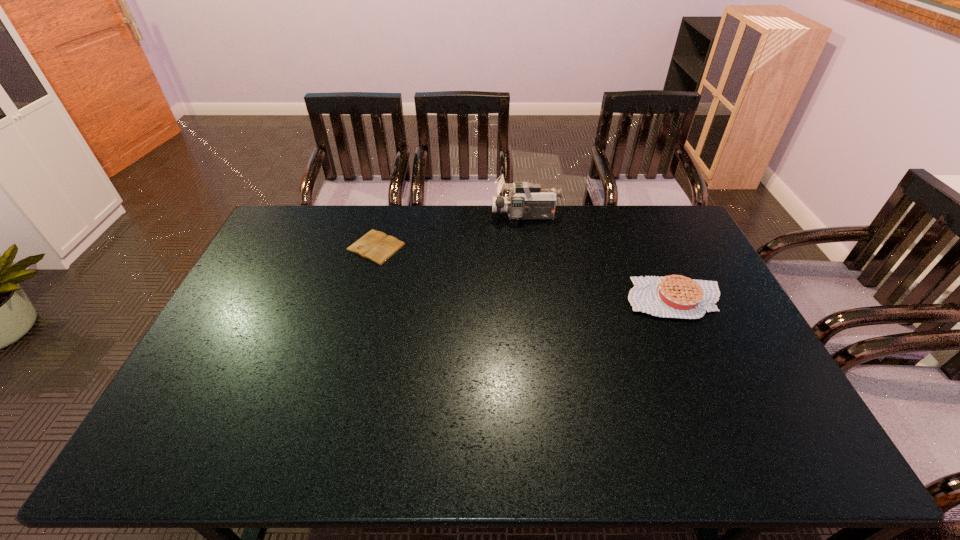
Image resolution: width=960 pixels, height=540 pixels. Find the location of `free space between the book and the tallest object`. free space between the book and the tallest object is located at coordinates (450, 232).

Locate an element on the screen. The image size is (960, 540). object that is the closest to the nearest object is located at coordinates point(527,201).

Select which object is the closest to the leftmost object. Please provide its 2D coordinates. Your answer should be formatted as a tuple, i.e. [(x, y)], where the tuple contains the x and y coordinates of a point satisfying the conditions above.

[(527, 201)]

Find the location of `vacant area that satisfies the following two spatial constraints: 1. on the front-facing side of the tallest object; 2. on the right side of the pie`. vacant area that satisfies the following two spatial constraints: 1. on the front-facing side of the tallest object; 2. on the right side of the pie is located at coordinates (536, 299).

You are a GUI agent. You are given a task and a screenshot of the screen. Output one action in this format:
    pyautogui.click(x=<x>, y=<y>)
    Task: Click on the vacant point that satisfies the following two spatial constraints: 1. on the front-facing side of the tallest object; 2. on the front side of the book
    
    Given the screenshot: What is the action you would take?
    pyautogui.click(x=529, y=247)

At what (x,y) coordinates should I click in order to perform the action: click on vacant area in the image that satisfies the following two spatial constraints: 1. on the front side of the book; 2. on the right side of the second tallest object. Please return your answer as a coordinate pair (x, y). The width and height of the screenshot is (960, 540). Looking at the image, I should click on (362, 299).

Locate an element on the screen. vacant position in the image that satisfies the following two spatial constraints: 1. on the front side of the pie; 2. on the left side of the leftmost object is located at coordinates coord(362,299).

Image resolution: width=960 pixels, height=540 pixels. I want to click on vacant region that satisfies the following two spatial constraints: 1. on the front-facing side of the camcorder; 2. on the right side of the nearest object, so [x=536, y=299].

Identify the location of vacant area in the image that satisfies the following two spatial constraints: 1. on the front-facing side of the pie; 2. on the right side of the tallest object. This screenshot has width=960, height=540. click(x=536, y=299).

Where is `blank space that satisfies the following two spatial constraints: 1. on the front-facing side of the farthest object; 2. on the left side of the pie`? Image resolution: width=960 pixels, height=540 pixels. blank space that satisfies the following two spatial constraints: 1. on the front-facing side of the farthest object; 2. on the left side of the pie is located at coordinates (536, 299).